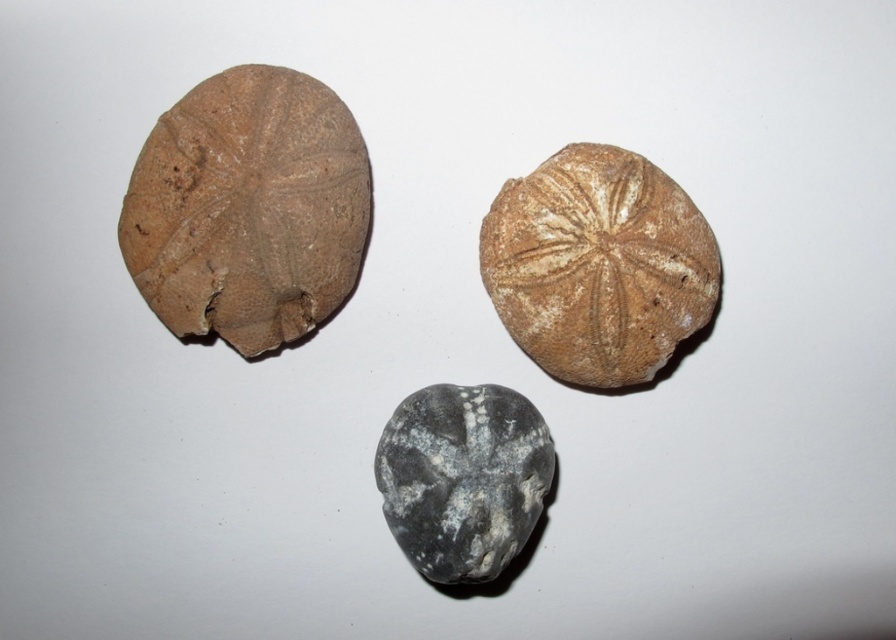
Can you confirm if brown textured shell at upper right is bigger than gray matte rock at center?

Yes.

Does brown textured shell at upper right have a lesser height compared to gray matte rock at center?

Incorrect, brown textured shell at upper right's height does not fall short of gray matte rock at center's.

Who is more distant from viewer, (x=515, y=182) or (x=435, y=513)?

The point (x=515, y=182) is behind.

This screenshot has width=896, height=640. I want to click on brown textured shell at upper right, so click(x=599, y=266).

Where is `brown fossilized shell at upper left`? The height and width of the screenshot is (640, 896). brown fossilized shell at upper left is located at coordinates (248, 209).

Is brown fossilized shell at upper left in front of brown textured shell at upper right?

Yes, it is in front of brown textured shell at upper right.

What do you see at coordinates (248, 209) in the screenshot?
I see `brown fossilized shell at upper left` at bounding box center [248, 209].

Locate an element on the screen. This screenshot has width=896, height=640. brown fossilized shell at upper left is located at coordinates (248, 209).

Does brown fossilized shell at upper left lie in front of gray matte rock at center?

That is False.

Which is behind, point (240, 124) or point (489, 554)?

Positioned behind is point (240, 124).

Where is `brown fossilized shell at upper left`? brown fossilized shell at upper left is located at coordinates (248, 209).